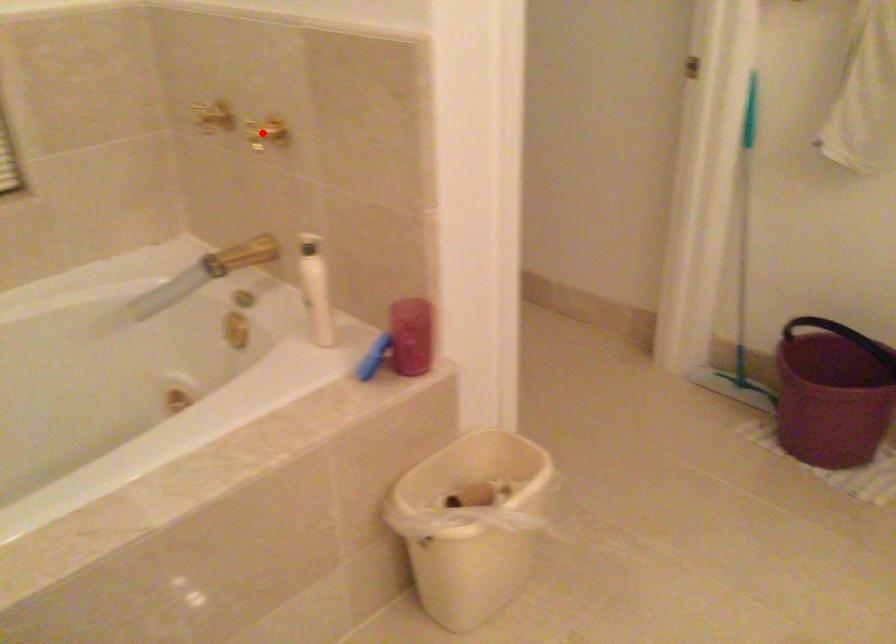
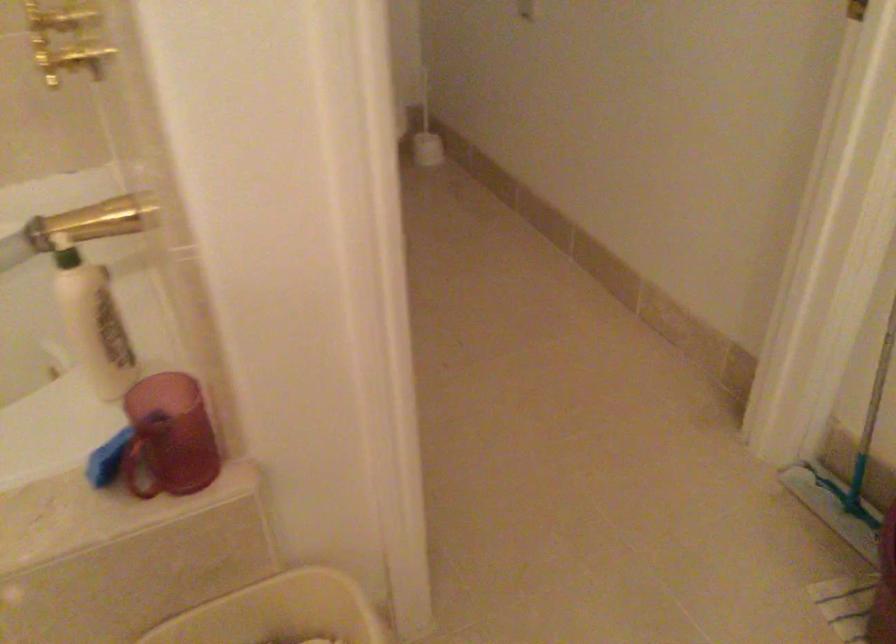
Question: I am providing you with two images of the same scene from different viewpoints. Image1 has a red point marked. In image2, the corresponding 3D location appears at what relative position? Reply with the corresponding letter.

Choices:
 (A) Closer
 (B) Farther

Answer: (A)